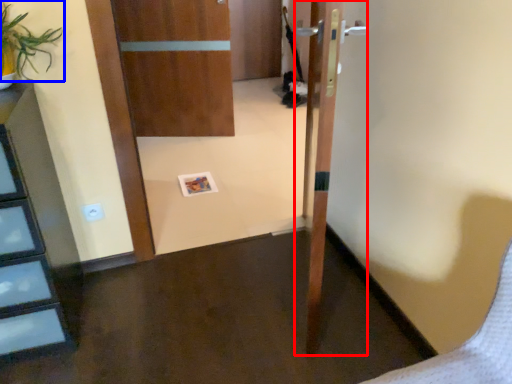
Question: Which object is closer to the camera taking this photo, door (highlighted by a red box) or plant (highlighted by a blue box)?

Choices:
 (A) door
 (B) plant

Answer: (A)